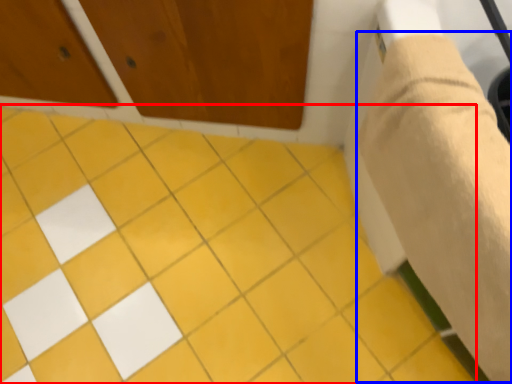
Question: Which object appears farthest to the camera in this image, ceramic tile (highlighted by a red box) or plaster bandage (highlighted by a blue box)?

Choices:
 (A) ceramic tile
 (B) plaster bandage

Answer: (A)